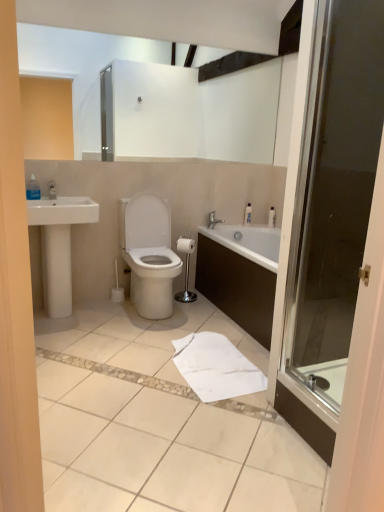
I want to click on transparent glass shower door at right, so click(x=333, y=199).

The height and width of the screenshot is (512, 384). Identify the location of transparent plastic bottle at upper left, which appears as the 3th toiletry when viewed from the back. (33, 189).

What do you see at coordinates (216, 367) in the screenshot?
I see `white paper towel at lower center` at bounding box center [216, 367].

This screenshot has height=512, width=384. I want to click on white ceramic sink at left, so click(59, 245).

Looking at this image, from a real-world perspective, which object stands above the other?

From a 3D spatial view, white plastic bottle at upper right, which is the 2th toiletry from back to front, is above.

From the image's perspective, would you say white plastic bottle at upper right, positioned as the 2th toiletry in right-to-left order, is positioned over white matte toilet paper at center?

Yes, from the image's perspective, white plastic bottle at upper right, positioned as the 2th toiletry in right-to-left order, is on top of white matte toilet paper at center.

Which of these two, white plastic bottle at upper right, positioned as the 2th toiletry in right-to-left order, or white matte toilet paper at center, is wider?

With larger width is white matte toilet paper at center.

Is white plastic bottle at upper right, placed as the 2th toiletry when sorted from left to right, oriented towards white matte toilet paper at center?

No.

Is point (33, 186) positioned before point (346, 141)?

That is False.

Do you think transparent plastic bottle at upper left, which appears as the 3th toiletry when viewed from the back, is within transparent glass shower door at right, or outside of it?

transparent plastic bottle at upper left, which appears as the 3th toiletry when viewed from the back, is spatially situated outside transparent glass shower door at right.

This screenshot has height=512, width=384. What are the coordinates of `the 1st toiletry below the transparent glass shower door at right (from a real-world perspective)` in the screenshot? It's located at (33, 189).

Are transparent glass shower door at right and transparent plastic bottle at upper left, the first toiletry viewed from the front, far apart?

Yes, transparent glass shower door at right and transparent plastic bottle at upper left, the first toiletry viewed from the front, are quite far apart.

Which is more to the left, transparent glass shower door at right or transparent plastic bottle at upper left, the third toiletry viewed from the right?

Positioned to the left is transparent plastic bottle at upper left, the third toiletry viewed from the right.

How many degrees apart are the facing directions of transparent glass shower door at right and transparent plastic bottle at upper left, marked as the 1th toiletry in a left-to-right arrangement?

The facing directions of transparent glass shower door at right and transparent plastic bottle at upper left, marked as the 1th toiletry in a left-to-right arrangement, are 92 degrees apart.

From a real-world perspective, who is located higher, transparent glass shower door at right or transparent plastic bottle at upper left, the third toiletry viewed from the right?

In real-world perspective, transparent glass shower door at right is above.

Is white glossy toilet at center positioned in front of silver metallic faucet at upper center?

Yes, it is.

From the image's perspective, which one is positioned higher, white glossy toilet at center or silver metallic faucet at upper center?

silver metallic faucet at upper center, from the image's perspective.

Can you confirm if white glossy toilet at center is taller than silver metallic faucet at upper center?

Correct, white glossy toilet at center is much taller as silver metallic faucet at upper center.

Between white glossy toilet at center and silver metallic faucet at upper center, which one appears on the right side from the viewer's perspective?

silver metallic faucet at upper center is more to the right.

From a real-world perspective, between silver metallic faucet at upper center and white plastic bottle at upper right, which is counted as the third toiletry, starting from the front, who is vertically lower?

silver metallic faucet at upper center, from a real-world perspective.

Does point (209, 227) appear closer or farther from the camera than point (270, 210)?

Point (209, 227) is positioned closer to the camera compared to point (270, 210).

From the image's perspective, would you say silver metallic faucet at upper center is shown under white plastic bottle at upper right, positioned as the 3th toiletry in left-to-right order?

Yes, from the image's perspective, silver metallic faucet at upper center is beneath white plastic bottle at upper right, positioned as the 3th toiletry in left-to-right order.

Is white paper towel at lower center wider than white plastic bottle at upper right, placed as the 2th toiletry when sorted from left to right?

Indeed, white paper towel at lower center has a greater width compared to white plastic bottle at upper right, placed as the 2th toiletry when sorted from left to right.

Is white paper towel at lower center turned away from white plastic bottle at upper right, placed as the 2th toiletry when sorted from left to right?

No, white paper towel at lower center is not facing away from white plastic bottle at upper right, placed as the 2th toiletry when sorted from left to right.

Which toiletry is the 1st one when counting from the right side of the white paper towel at lower center? Please provide its 2D coordinates.

[(248, 214)]

From a real-world perspective, who is located lower, white paper towel at lower center or white plastic bottle at upper right, positioned as the second toiletry in front-to-back order?

From a 3D spatial view, white paper towel at lower center is below.

From a real-world perspective, is white glossy toilet at center positioned above or below transparent plastic bottle at upper left, marked as the 1th toiletry in a left-to-right arrangement?

white glossy toilet at center is situated lower than transparent plastic bottle at upper left, marked as the 1th toiletry in a left-to-right arrangement, in the real world.

The image size is (384, 512). In order to click on toilet on the right of the transparent plastic bottle at upper left, marked as the 1th toiletry in a left-to-right arrangement in this screenshot , I will do `click(149, 253)`.

In the scene shown: From the image's perspective, is white glossy toilet at center above transparent plastic bottle at upper left, which appears as the 3th toiletry when viewed from the back?

Incorrect, from the image's perspective, white glossy toilet at center is lower than transparent plastic bottle at upper left, which appears as the 3th toiletry when viewed from the back.

In order to click on the 1st toiletry to the right when counting from the white matte toilet paper at center in this screenshot , I will do `click(248, 214)`.

In order to click on the 1st toiletry behind the transparent glass shower door at right, starting your count from the anchor in this screenshot , I will do `click(33, 189)`.

Looking at the image, which one is located closer to silver metallic faucet at upper center, white plastic bottle at upper right, acting as the 1th toiletry starting from the right, or white plastic bottle at upper right, which is the 2th toiletry from back to front?

white plastic bottle at upper right, which is the 2th toiletry from back to front, lies closer to silver metallic faucet at upper center than the other object.

Looking at the image, which one is located closer to white ceramic sink at left, silver metallic faucet at upper center or white plastic bottle at upper right, placed as the 2th toiletry when sorted from left to right?

Based on the image, silver metallic faucet at upper center appears to be nearer to white ceramic sink at left.

In the scene shown: Looking at the image, which one is located further to silver metallic faucet at upper center, white matte toilet paper at center or white plastic bottle at upper right, which is the 2th toiletry from back to front?

Based on the image, white plastic bottle at upper right, which is the 2th toiletry from back to front, appears to be further to silver metallic faucet at upper center.

From the image, which object appears to be nearer to white paper towel at lower center, transparent plastic bottle at upper left, the third toiletry viewed from the right, or white plastic bottle at upper right, which is counted as the third toiletry, starting from the front?

Based on the image, transparent plastic bottle at upper left, the third toiletry viewed from the right, appears to be nearer to white paper towel at lower center.

Considering their positions, is white plastic bottle at upper right, positioned as the 2th toiletry in right-to-left order, positioned closer to white paper towel at lower center than white glossy toilet at center?

white glossy toilet at center.

Estimate the real-world distances between objects in this image. Which object is closer to transparent plastic bottle at upper left, the third toiletry viewed from the right, white ceramic sink at left or white plastic bottle at upper right, which is counted as the third toiletry, starting from the front?

white ceramic sink at left.

From the image, which object appears to be farther from white plastic bottle at upper right, positioned as the 2th toiletry in right-to-left order, white plastic bottle at upper right, positioned as the 3th toiletry in left-to-right order, or silver metallic faucet at upper center?

silver metallic faucet at upper center is positioned further to the anchor white plastic bottle at upper right, positioned as the 2th toiletry in right-to-left order.

Which object lies nearer to the anchor point transparent plastic bottle at upper left, the third toiletry viewed from the right, white matte toilet paper at center or silver metallic faucet at upper center?

white matte toilet paper at center is positioned closer to the anchor transparent plastic bottle at upper left, the third toiletry viewed from the right.

You are a GUI agent. You are given a task and a screenshot of the screen. Output one action in this format:
    pyautogui.click(x=<x>, y=<y>)
    Task: Click on the sink between transparent glass shower door at right and white glossy toilet at center along the z-axis
    
    Given the screenshot: What is the action you would take?
    pyautogui.click(x=59, y=245)

Where is `tap between white ceramic sink at left and white plastic bottle at upper right, placed as the 1th toiletry when sorted from back to front`? Image resolution: width=384 pixels, height=512 pixels. tap between white ceramic sink at left and white plastic bottle at upper right, placed as the 1th toiletry when sorted from back to front is located at coordinates (213, 220).

Identify the location of toiletry between silver metallic faucet at upper center and white plastic bottle at upper right, which is counted as the third toiletry, starting from the front, from left to right. This screenshot has width=384, height=512. (248, 214).

Find the location of a particular element. The height and width of the screenshot is (512, 384). bath towel between transparent glass shower door at right and silver metallic faucet at upper center in the front-back direction is located at coordinates (216, 367).